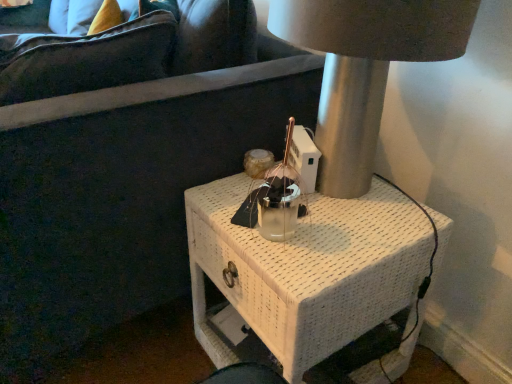
At what (x,y) coordinates should I click in order to perform the action: click on empty space that is ontop of white woven nightstand at center (from a real-world perspective). Please return your answer as a coordinate pair (x, y). The image size is (512, 384). Looking at the image, I should click on click(321, 214).